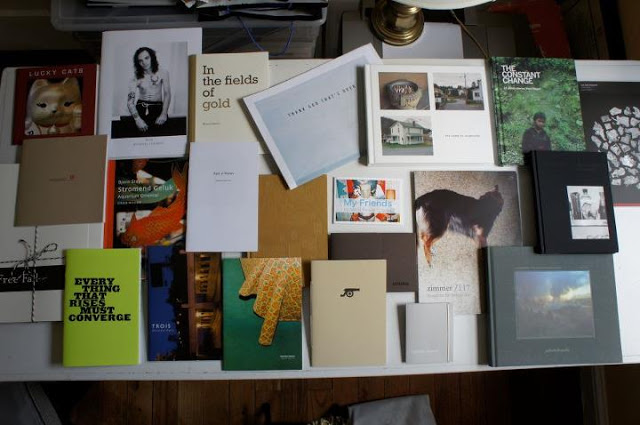
The width and height of the screenshot is (640, 425). Find the location of `floor`. floor is located at coordinates (208, 422).